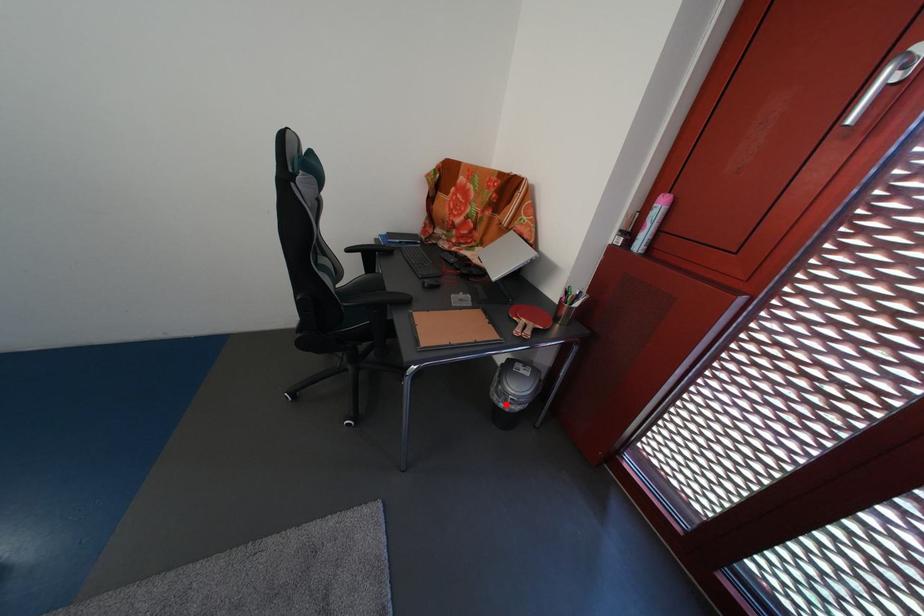
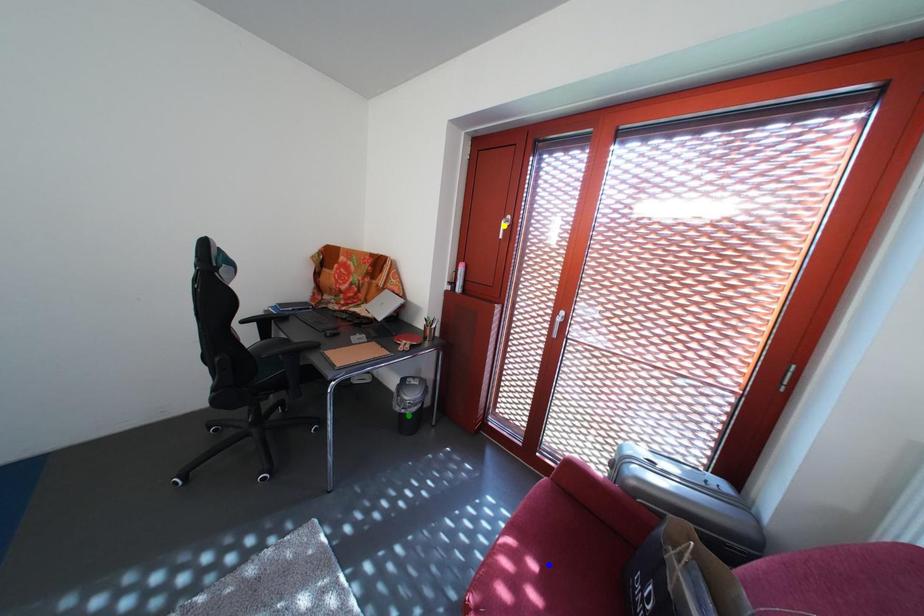
Question: I am providing you with two images of the same scene from different viewpoints. A red point is marked on the first image. You are given multiple points on the second image. Which spot in image 2 lines up with the point in image 1?

Choices:
 (A) blue point
 (B) green point
 (C) yellow point

Answer: (B)